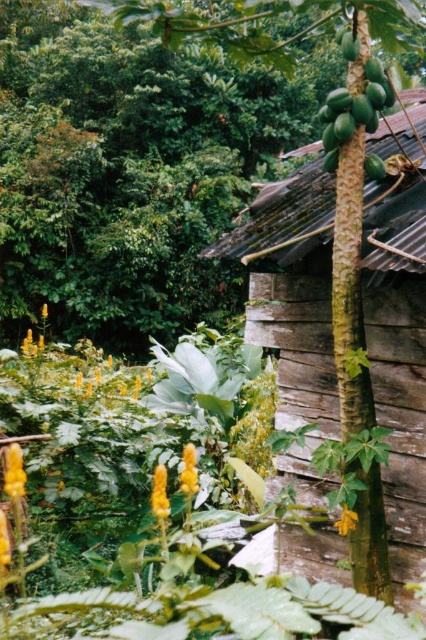
Consider the image. Does wooden hut at right come behind green papaya at center?

Yes.

Does wooden hut at right have a lesser height compared to green papaya at center?

Correct, wooden hut at right is not as tall as green papaya at center.

This screenshot has height=640, width=426. What do you see at coordinates (293, 305) in the screenshot?
I see `wooden hut at right` at bounding box center [293, 305].

Identify the location of wooden hut at right. The width and height of the screenshot is (426, 640). (293, 305).

Is wooden hut at right positioned behind green matte banana tree at center?

Yes, wooden hut at right is behind green matte banana tree at center.

Can you confirm if wooden hut at right is positioned to the left of green matte banana tree at center?

Indeed, wooden hut at right is positioned on the left side of green matte banana tree at center.

This screenshot has width=426, height=640. I want to click on wooden hut at right, so click(293, 305).

Describe the element at coordinates (350, 291) in the screenshot. I see `green matte banana tree at center` at that location.

Between green matte banana tree at center and green papaya at center, which one has more height?

With more height is green matte banana tree at center.

What do you see at coordinates (350, 291) in the screenshot?
I see `green matte banana tree at center` at bounding box center [350, 291].

You are a GUI agent. You are given a task and a screenshot of the screen. Output one action in this format:
    pyautogui.click(x=<x>, y=<y>)
    Task: Click on the green matte banana tree at center
    This screenshot has width=426, height=640.
    Given the screenshot: What is the action you would take?
    pyautogui.click(x=350, y=291)